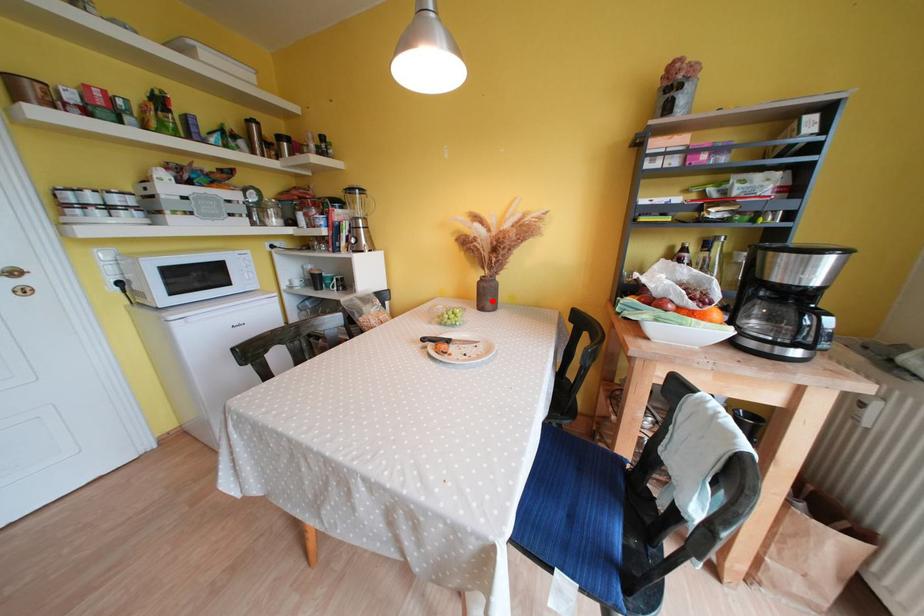
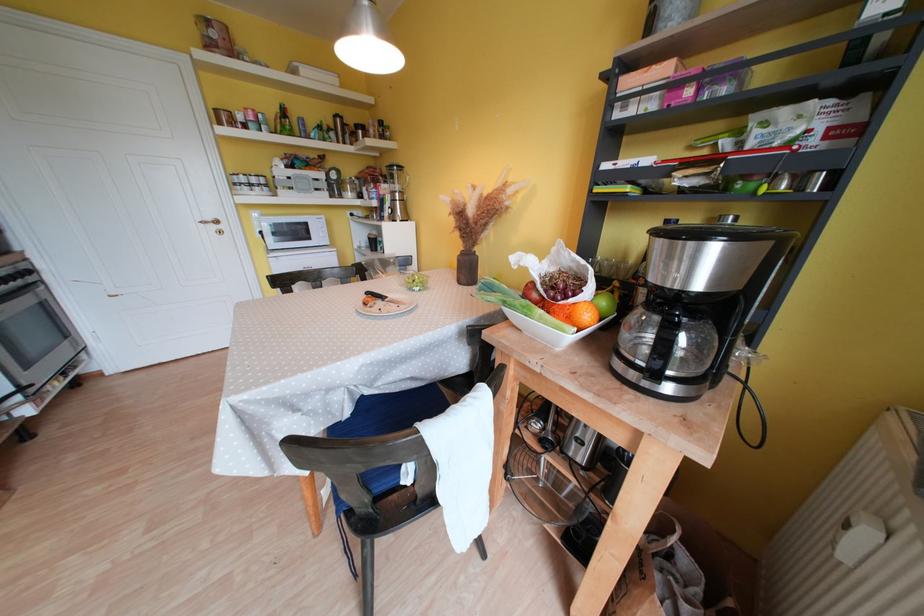
In the second image, find the point that corresponds to the highlighted location in the first image.

(472, 275)